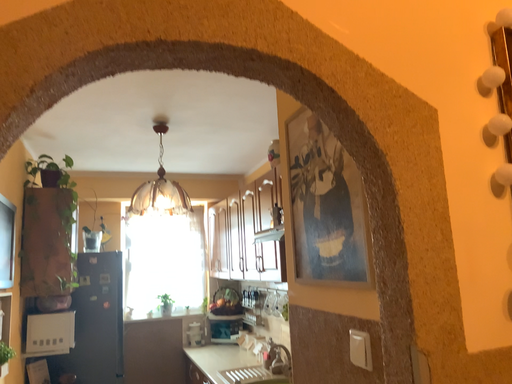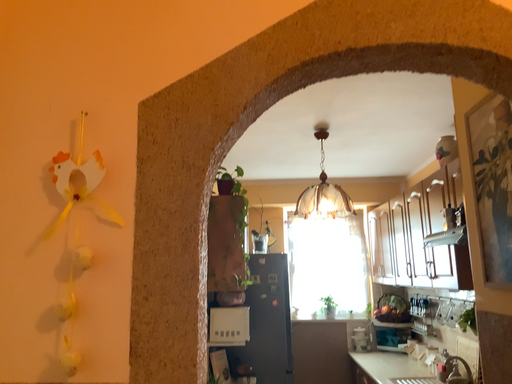
Question: How did the camera likely rotate when shooting the video?

Choices:
 (A) rotated left
 (B) rotated right

Answer: (A)